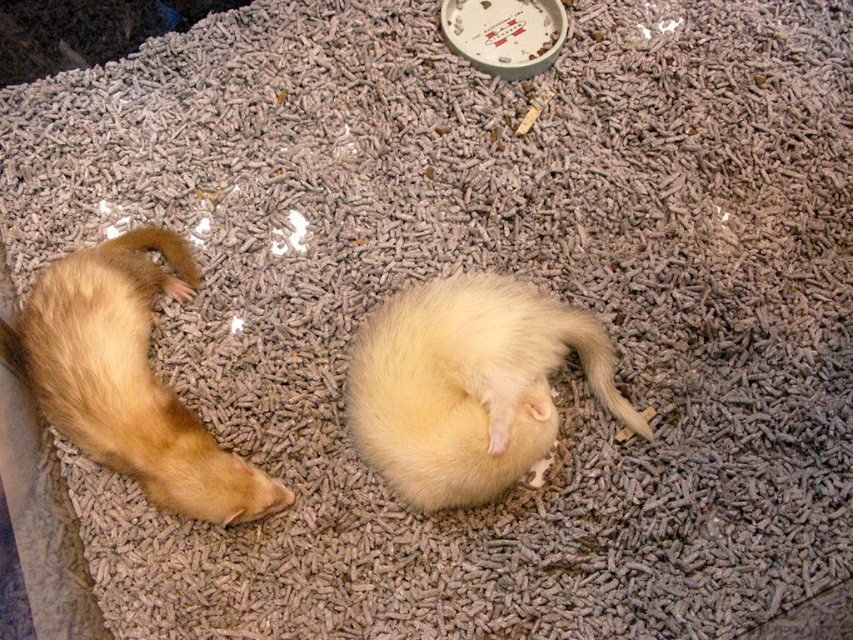
Does fluffy white ferret at center have a smaller size compared to yellow fur at lower center?

No, fluffy white ferret at center is not smaller than yellow fur at lower center.

Based on the photo, who is shorter, fluffy white ferret at center or yellow fur at lower center?

yellow fur at lower center

Find the location of a particular element. fluffy white ferret at center is located at coordinates click(467, 385).

Is golden fur ferret at left bigger than yellow fur at lower center?

Yes, golden fur ferret at left is bigger than yellow fur at lower center.

Does golden fur ferret at left have a greater height compared to yellow fur at lower center?

Yes, golden fur ferret at left is taller than yellow fur at lower center.

Find the location of a particular element. The image size is (853, 640). golden fur ferret at left is located at coordinates (131, 378).

Where is `golden fur ferret at left`? Image resolution: width=853 pixels, height=640 pixels. golden fur ferret at left is located at coordinates (131, 378).

Is point (491, 320) positioned before point (48, 356)?

That is True.

Does point (532, 289) lie behind point (138, 467)?

That is True.

Where is `fluffy white ferret at center`? Image resolution: width=853 pixels, height=640 pixels. fluffy white ferret at center is located at coordinates (467, 385).